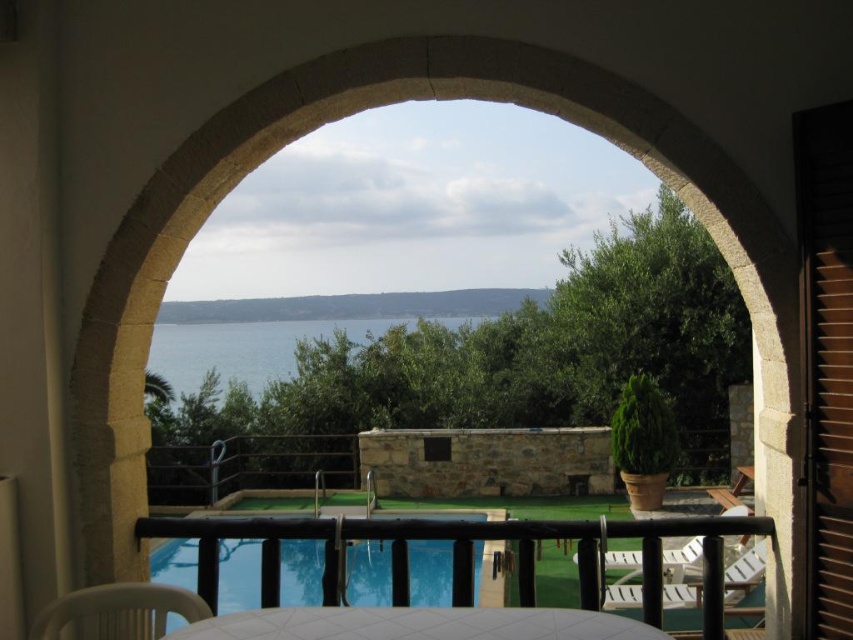
Is blue water at center bigger than white plastic chair at lower right?

Incorrect, blue water at center is not larger than white plastic chair at lower right.

Can you confirm if blue water at center is positioned above white plastic chair at lower right?

Indeed, blue water at center is positioned over white plastic chair at lower right.

From the picture: Measure the distance between blue water at center and camera.

blue water at center and camera are 20.20 meters apart from each other.

What are the coordinates of `blue water at center` in the screenshot? It's located at (x=247, y=348).

Can you confirm if blue water at center is positioned to the left of white plastic chair at lower left?

Yes, blue water at center is to the left of white plastic chair at lower left.

Is point (276, 330) positioned in front of point (155, 584)?

No, it is behind (155, 584).

Describe the element at coordinates (247, 348) in the screenshot. I see `blue water at center` at that location.

I want to click on blue water at center, so click(x=247, y=348).

Which is more to the right, transparent glass pool at center or white plastic chair at lower left?

white plastic chair at lower left is more to the right.

What do you see at coordinates (238, 573) in the screenshot?
I see `transparent glass pool at center` at bounding box center [238, 573].

Locate an element on the screen. The width and height of the screenshot is (853, 640). transparent glass pool at center is located at coordinates (238, 573).

Where is `transparent glass pool at center`? The height and width of the screenshot is (640, 853). transparent glass pool at center is located at coordinates (238, 573).